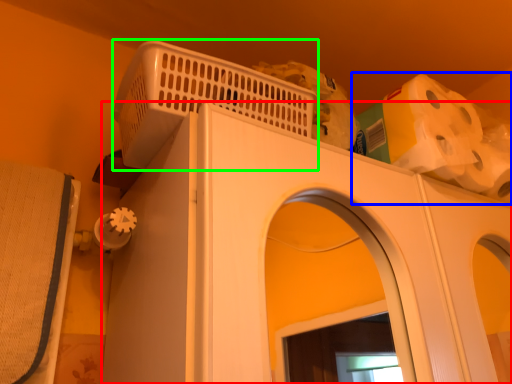
Question: Which object is the farthest from home appliance (highlighted by a red box)? Choose among these: toilet paper (highlighted by a blue box) or basket (highlighted by a green box).

Choices:
 (A) toilet paper
 (B) basket

Answer: (A)